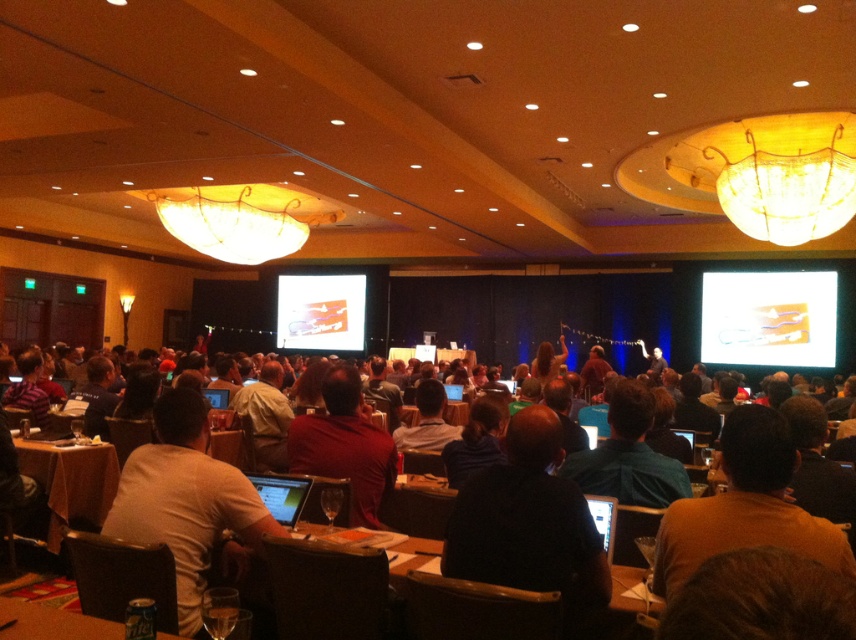
You are standing in the conference room and want to walk from point (x=633, y=618) to point (x=40, y=625). Since both points are in the same room, will you have to walk forward or backward to reach the second point?

Since point (x=633, y=618) is further to the viewer than point (x=40, y=625), you will have to walk forward to reach the second point because it is closer to you.

You are organizing a photo shoot in the conference room and need to place two props on the tables. The dark brown leather jacket at center and the white matte shirt at center must be placed such that their widths are accommodated. Given that the table has a width of 1 meter, can both items fit side by side without overlapping?

The dark brown leather jacket at center has a width less than the white matte shirt at center. Since the table is 1 meter wide, both items can fit side by side as their combined width is less than 1 meter.

You are an event organizer who needs to move a heavy projector from the orange fabric table at lower left to the wooden table at center. Can you lift the projector directly upwards without moving any other objects, considering their positions?

The orange fabric table at lower left is positioned under the wooden table at center, so lifting the projector directly upwards would not be possible without hitting the wooden table at center. You need to move it sideways first.